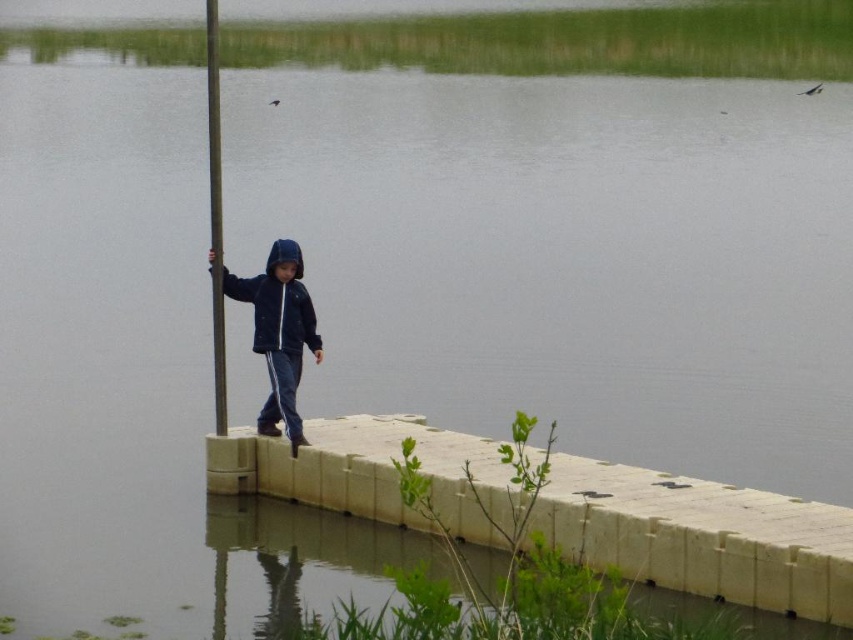
Based on the photo, who is taller, white concrete ledge at center or metallic pole at left?

metallic pole at left is taller.

Can you confirm if white concrete ledge at center is positioned below metallic pole at left?

Yes, white concrete ledge at center is below metallic pole at left.

Which is behind, point (740, 595) or point (212, 131)?

Point (212, 131)

At what (x,y) coordinates should I click in order to perform the action: click on white concrete ledge at center. Please return your answer as a coordinate pair (x, y). Looking at the image, I should click on (701, 536).

Does point (259, 346) lie behind point (213, 186)?

Yes.

Between dark blue jacket at center and metallic pole at left, which one appears on the left side from the viewer's perspective?

Positioned to the left is metallic pole at left.

Locate an element on the screen. This screenshot has width=853, height=640. dark blue jacket at center is located at coordinates (279, 332).

Is white concrete ledge at center further to camera compared to dark blue jacket at center?

No, white concrete ledge at center is closer to the viewer.

Image resolution: width=853 pixels, height=640 pixels. Describe the element at coordinates (701, 536) in the screenshot. I see `white concrete ledge at center` at that location.

Find the location of `white concrete ledge at center`. white concrete ledge at center is located at coordinates (701, 536).